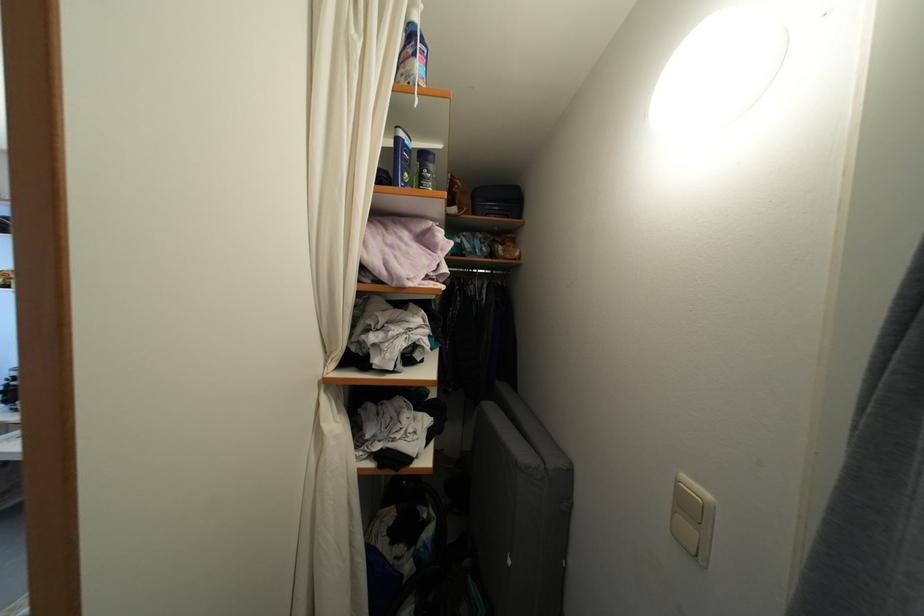
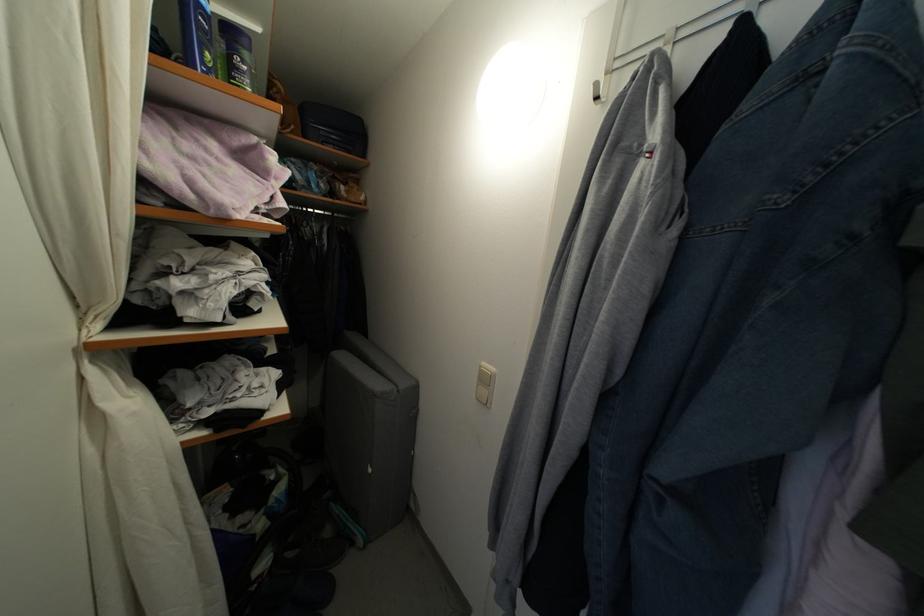
Question: I am providing you with two images of the same scene from different viewpoints. Please identify which objects are invisible in image2.

Choices:
 (A) dark blue suitcase
 (B) white switch button
 (C) dark plastic bottle
 (D) none of these

Answer: (D)